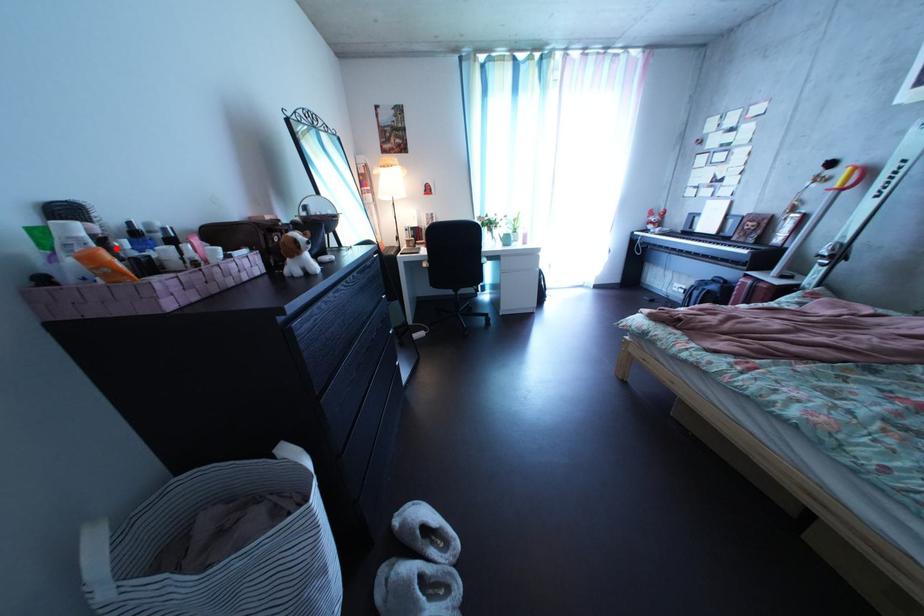
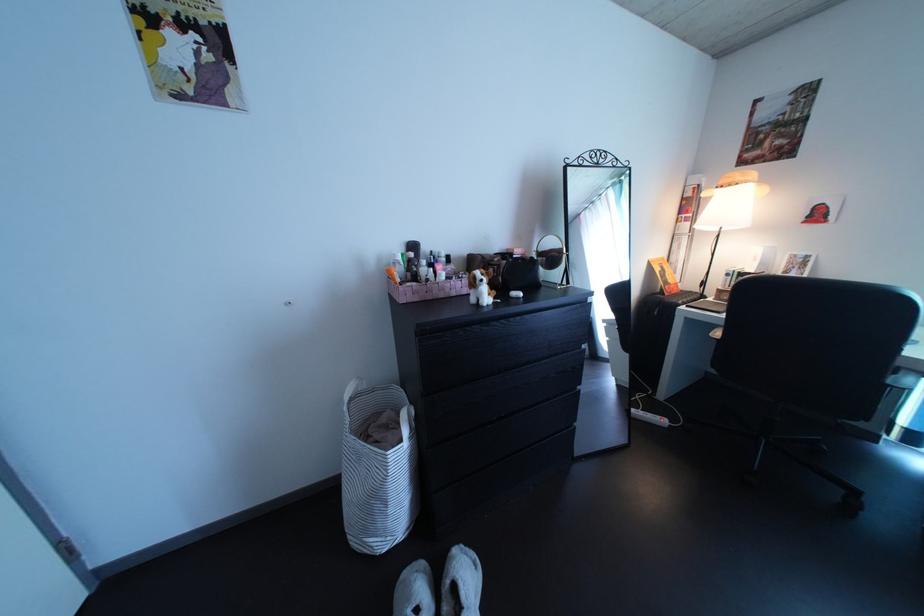
Find the pixel in the second image that matches the highlighted location in the first image.

(424, 269)